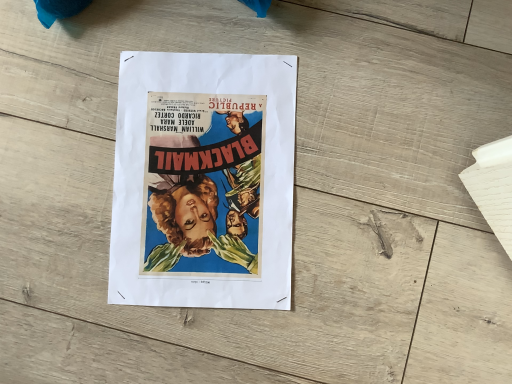
You are a GUI agent. You are given a task and a screenshot of the screen. Output one action in this format:
    pyautogui.click(x=<x>, y=<y>)
    Task: Click on the free point above matte paper poster at center (from a real-world perspective)
    
    Given the screenshot: What is the action you would take?
    pyautogui.click(x=197, y=182)